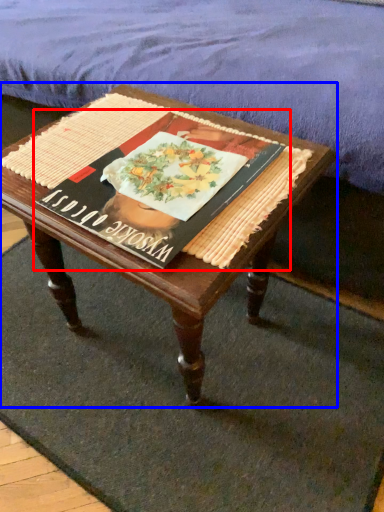
Question: Among these objects, which one is nearest to the camera, paperback book (highlighted by a red box) or coffee table (highlighted by a blue box)?

Choices:
 (A) paperback book
 (B) coffee table

Answer: (B)